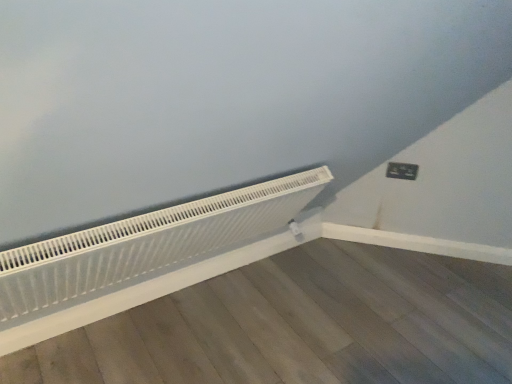
Question: Is black plastic electric outlet at upper right to the left or to the right of white matte radiator at lower left in the image?

Choices:
 (A) left
 (B) right

Answer: (B)

Question: From the image's perspective, relative to white matte radiator at lower left, is black plastic electric outlet at upper right above or below?

Choices:
 (A) above
 (B) below

Answer: (A)

Question: Considering their positions, is black plastic electric outlet at upper right located in front of or behind white matte radiator at lower left?

Choices:
 (A) front
 (B) behind

Answer: (B)

Question: Considering the relative positions of white matte radiator at lower left and black plastic electric outlet at upper right in the image provided, is white matte radiator at lower left to the left or to the right of black plastic electric outlet at upper right?

Choices:
 (A) right
 (B) left

Answer: (B)

Question: From a real-world perspective, is white matte radiator at lower left physically located above or below black plastic electric outlet at upper right?

Choices:
 (A) below
 (B) above

Answer: (A)

Question: Based on their sizes in the image, would you say white matte radiator at lower left is bigger or smaller than black plastic electric outlet at upper right?

Choices:
 (A) big
 (B) small

Answer: (A)

Question: Is white matte radiator at lower left spatially inside black plastic electric outlet at upper right, or outside of it?

Choices:
 (A) outside
 (B) inside

Answer: (A)